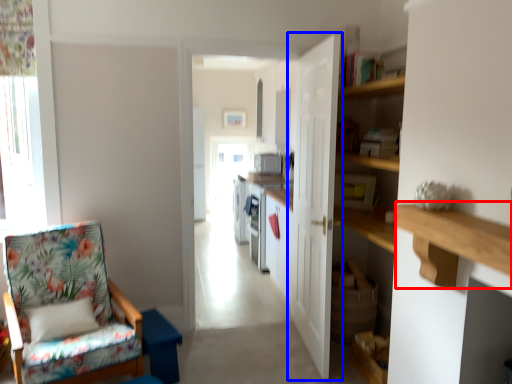
Question: Which object appears farthest to the camera in this image, ledge (highlighted by a red box) or door (highlighted by a blue box)?

Choices:
 (A) ledge
 (B) door

Answer: (B)